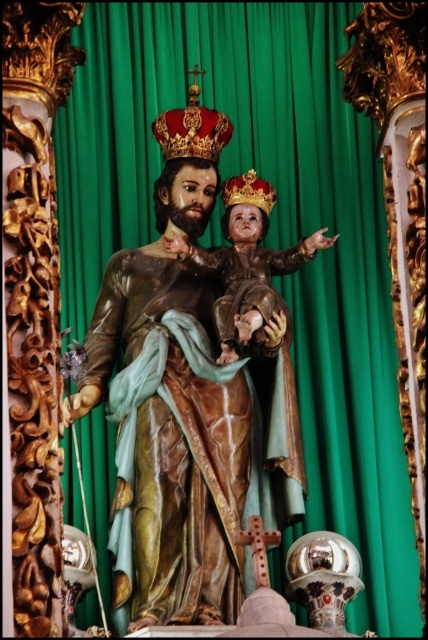
You are an art conservator assessing the placement of items in the image. The shiny red crown at upper center and the wooden cross at center are both important elements. Based on their positions, which object appears taller?

The shiny red crown at upper center appears taller than the wooden cross at center.

In the scene shown: You are an art conservator examining the statue. You need to place a protective shield over the shiny red crown at upper center. The shield must be positioned precisely at the coordinates given. What are the coordinates where you should place the shield?

The coordinates for placing the shield over the shiny red crown at upper center are at point (x=192, y=129).